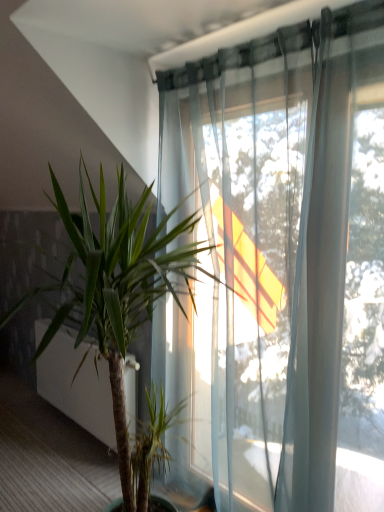
Locate an element on the screen. This screenshot has height=512, width=384. green leafy plant at lower left is located at coordinates (77, 385).

In order to face green leafy plant at lower left, should I rotate leftwards or rightwards?

To align with it, rotate left about 14.412°.

What do you see at coordinates (77, 385) in the screenshot? I see `green leafy plant at lower left` at bounding box center [77, 385].

Measure the distance between point (140, 464) and camera.

Point (140, 464) and camera are 5.94 feet apart from each other.

You are a GUI agent. You are given a task and a screenshot of the screen. Output one action in this format:
    pyautogui.click(x=<x>, y=<y>)
    Task: Click on the green leafy plant at center
    This screenshot has height=512, width=384.
    Given the screenshot: What is the action you would take?
    pyautogui.click(x=117, y=297)

This screenshot has width=384, height=512. What do you see at coordinates (117, 297) in the screenshot?
I see `green leafy plant at center` at bounding box center [117, 297].

This screenshot has width=384, height=512. I want to click on green leafy plant at lower left, so click(77, 385).

In the image, is green leafy plant at center on the left side or the right side of green leafy plant at lower left?

Based on their positions, green leafy plant at center is located to the right of green leafy plant at lower left.

Who is more distant, green leafy plant at center or green leafy plant at lower left?

green leafy plant at lower left is further away from the camera.

Is point (134, 289) closer to viewer compared to point (94, 370)?

Yes, it is in front of point (94, 370).

From the image's perspective, is green leafy plant at center located above or below green leafy plant at lower left?

Clearly, from the image's perspective, green leafy plant at center is above green leafy plant at lower left.

From a real-world perspective, is green leafy plant at center over green leafy plant at lower left?

Yes, from a real-world perspective, green leafy plant at center is above green leafy plant at lower left.

Is green leafy plant at center wider than green leafy plant at lower left?

Yes, green leafy plant at center is wider than green leafy plant at lower left.

Can you confirm if green leafy plant at center is shorter than green leafy plant at lower left?

In fact, green leafy plant at center may be taller than green leafy plant at lower left.

Who is smaller, green leafy plant at center or green leafy plant at lower left?

green leafy plant at lower left is smaller.

Can we say green leafy plant at center lies outside green leafy plant at lower left?

Indeed, green leafy plant at center is completely outside green leafy plant at lower left.

Does green leafy plant at center touch green leafy plant at lower left?

green leafy plant at center is not next to green leafy plant at lower left, and they're not touching.

In the scene shown: Is green leafy plant at center oriented towards green leafy plant at lower left?

No, green leafy plant at center is not facing towards green leafy plant at lower left.

What's the angular difference between green leafy plant at center and green leafy plant at lower left's facing directions?

There is a 4.98-degree angle between the facing directions of green leafy plant at center and green leafy plant at lower left.

What are the coordinates of `screen door lying behind the green leafy plant at center` in the screenshot? It's located at (77, 385).

In the image, is green leafy plant at lower left on the left side or the right side of green leafy plant at center?

green leafy plant at lower left is positioned on green leafy plant at center's left side.

Is green leafy plant at lower left positioned before green leafy plant at center?

No, the depth of green leafy plant at lower left is greater than that of green leafy plant at center.

Does point (57, 394) appear closer or farther from the camera than point (111, 220)?

Point (57, 394) is positioned farther from the camera compared to point (111, 220).

Looking at this image, from the image's perspective, which is above, green leafy plant at lower left or green leafy plant at center?

green leafy plant at center is shown above in the image.

From a real-world perspective, who is located lower, green leafy plant at lower left or green leafy plant at center?

green leafy plant at lower left is physically lower.

Does green leafy plant at lower left have a greater width compared to green leafy plant at center?

No.

Is green leafy plant at lower left taller or shorter than green leafy plant at center?

green leafy plant at lower left is shorter than green leafy plant at center.

Considering the sizes of green leafy plant at lower left and green leafy plant at center in the image, is green leafy plant at lower left bigger or smaller than green leafy plant at center?

green leafy plant at lower left is smaller than green leafy plant at center.

Looking at this image, choose the correct answer: Is green leafy plant at lower left inside green leafy plant at center or outside it?

green leafy plant at lower left cannot be found inside green leafy plant at center.

Is there a large distance between green leafy plant at lower left and green leafy plant at center?

No, there isn't a large distance between green leafy plant at lower left and green leafy plant at center.

Could you tell me if green leafy plant at lower left is turned towards green leafy plant at center?

No, green leafy plant at lower left is not oriented towards green leafy plant at center.

What's the angular difference between green leafy plant at lower left and green leafy plant at center's facing directions?

The facing directions of green leafy plant at lower left and green leafy plant at center are 4.98 degrees apart.

How distant is green leafy plant at lower left from green leafy plant at center?

The distance of green leafy plant at lower left from green leafy plant at center is 27.02 inches.

At what (x,y) coordinates should I click in order to perform the action: click on houseplant on the right of green leafy plant at lower left. Please return your answer as a coordinate pair (x, y). Looking at the image, I should click on (117, 297).

Identify the location of screen door below the green leafy plant at center (from the image's perspective). (77, 385).

Identify the location of screen door lying behind the green leafy plant at center. (77, 385).